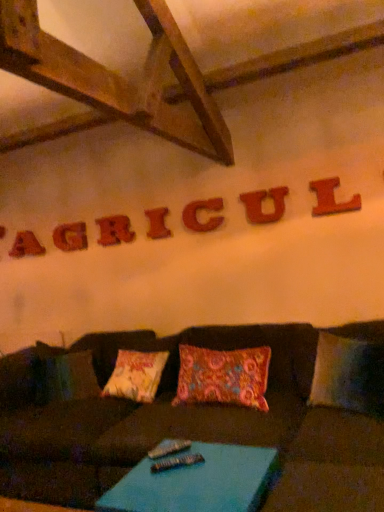
Question: Is metallic silver remote at center looking in the opposite direction of wooden letter l at upper right, which appears as the 1th letter when viewed from the front?

Choices:
 (A) yes
 (B) no

Answer: (B)

Question: From a real-world perspective, does metallic silver remote at center stand above wooden letter l at upper right, positioned as the 1th letter in right-to-left order?

Choices:
 (A) no
 (B) yes

Answer: (A)

Question: Does metallic silver remote at center turn towards wooden letter l at upper right, which is the 7th letter from left to right?

Choices:
 (A) yes
 (B) no

Answer: (B)

Question: Considering the relative positions of metallic silver remote at center and wooden letter l at upper right, the seventh letter when ordered from back to front, in the image provided, is metallic silver remote at center to the left of wooden letter l at upper right, the seventh letter when ordered from back to front, from the viewer's perspective?

Choices:
 (A) no
 (B) yes

Answer: (B)

Question: From the image's perspective, does metallic silver remote at center appear lower than wooden letter l at upper right, the seventh letter when ordered from back to front?

Choices:
 (A) yes
 (B) no

Answer: (A)

Question: In the image, is wooden letter c at center, the 5th letter in the left-to-right sequence, positioned in front of or behind brown fabric couch at center?

Choices:
 (A) behind
 (B) front

Answer: (A)

Question: Is point (200, 228) closer or farther from the camera than point (195, 426)?

Choices:
 (A) closer
 (B) farther

Answer: (B)

Question: In terms of height, does wooden letter c at center, placed as the 3th letter when sorted from front to back, look taller or shorter compared to brown fabric couch at center?

Choices:
 (A) short
 (B) tall

Answer: (A)

Question: Looking at the image, does wooden letter c at center, the 5th letter in the left-to-right sequence, seem bigger or smaller compared to brown fabric couch at center?

Choices:
 (A) big
 (B) small

Answer: (B)

Question: Is wooden letter i at center, marked as the fourth letter in a front-to-back arrangement, bigger or smaller than red wood letter a at upper left, which is counted as the first letter, starting from the left?

Choices:
 (A) big
 (B) small

Answer: (B)

Question: In the image, is wooden letter i at center, the fourth letter when ordered from back to front, positioned in front of or behind red wood letter a at upper left, positioned as the seventh letter in front-to-back order?

Choices:
 (A) behind
 (B) front

Answer: (B)

Question: Is wooden letter i at center, marked as the 4th letter in a right-to-left arrangement, taller or shorter than red wood letter a at upper left, positioned as the seventh letter in front-to-back order?

Choices:
 (A) tall
 (B) short

Answer: (B)

Question: From a real-world perspective, is wooden letter i at center, marked as the fourth letter in a front-to-back arrangement, positioned above or below red wood letter a at upper left, which is counted as the 1th letter, starting from the back?

Choices:
 (A) above
 (B) below

Answer: (B)

Question: From a real-world perspective, is red wood letter a at upper left, positioned as the seventh letter in front-to-back order, above or below wooden letter i at center, marked as the 4th letter in a right-to-left arrangement?

Choices:
 (A) above
 (B) below

Answer: (A)

Question: Is red wood letter a at upper left, which is counted as the first letter, starting from the left, wider or thinner than wooden letter i at center, marked as the 4th letter in a right-to-left arrangement?

Choices:
 (A) thin
 (B) wide

Answer: (B)